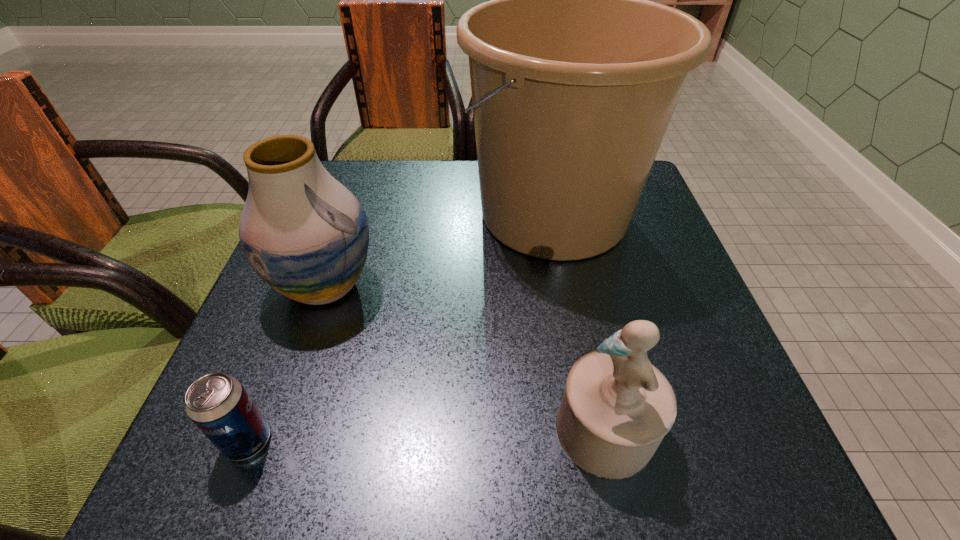
Image resolution: width=960 pixels, height=540 pixels. In the image, there is a desktop. What are the coordinates of `vacant space at the far edge` in the screenshot? It's located at (397, 211).

Identify the location of vacant region at the near edge. (385, 449).

Image resolution: width=960 pixels, height=540 pixels. Find the location of `free space at the left edge of the desktop`. free space at the left edge of the desktop is located at coordinates (270, 288).

The image size is (960, 540). In the image, there is a desktop. Find the location of `vacant space at the right edge`. vacant space at the right edge is located at coordinates (680, 358).

In order to click on free space at the far left corner of the desktop in this screenshot , I will do `click(379, 173)`.

You are a GUI agent. You are given a task and a screenshot of the screen. Output one action in this format:
    pyautogui.click(x=<x>, y=<y>)
    Task: Click on the free space that is in between the beer can and the second shortest object
    This screenshot has height=540, width=960.
    Given the screenshot: What is the action you would take?
    pyautogui.click(x=426, y=435)

Locate an element on the screen. empty space that is in between the bucket and the vase is located at coordinates (440, 250).

Locate an element on the screen. free point between the bucket and the shortest object is located at coordinates (400, 327).

The image size is (960, 540). I want to click on blank region between the vase and the figurine, so click(466, 357).

Find the location of a particular element. The height and width of the screenshot is (540, 960). vacant space that is in between the vase and the shortest object is located at coordinates (286, 363).